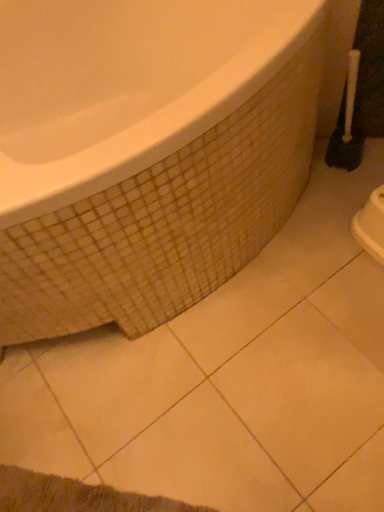
Question: From a real-world perspective, is white plastic toilet brush at right positioned above or below white glossy bathtub at upper left?

Choices:
 (A) above
 (B) below

Answer: (B)

Question: Looking at their shapes, would you say white plastic toilet brush at right is wider or thinner than white glossy bathtub at upper left?

Choices:
 (A) thin
 (B) wide

Answer: (A)

Question: Is point (342, 102) closer or farther from the camera than point (304, 45)?

Choices:
 (A) closer
 (B) farther

Answer: (B)

Question: From their relative heights in the image, would you say white glossy bathtub at upper left is taller or shorter than white plastic toilet brush at right?

Choices:
 (A) tall
 (B) short

Answer: (A)

Question: Is point (39, 317) closer or farther from the camera than point (332, 151)?

Choices:
 (A) farther
 (B) closer

Answer: (B)

Question: In terms of size, does white glossy bathtub at upper left appear bigger or smaller than white plastic toilet brush at right?

Choices:
 (A) small
 (B) big

Answer: (B)

Question: Based on their positions, is white glossy bathtub at upper left located to the left or right of white plastic toilet brush at right?

Choices:
 (A) right
 (B) left

Answer: (B)